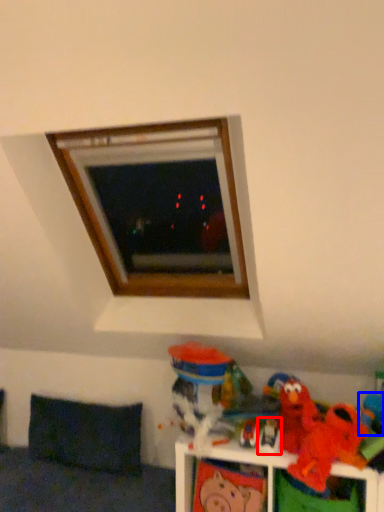
Question: Which point is further to the camera, toy (highlighted by a red box) or toy (highlighted by a blue box)?

Choices:
 (A) toy
 (B) toy

Answer: (A)